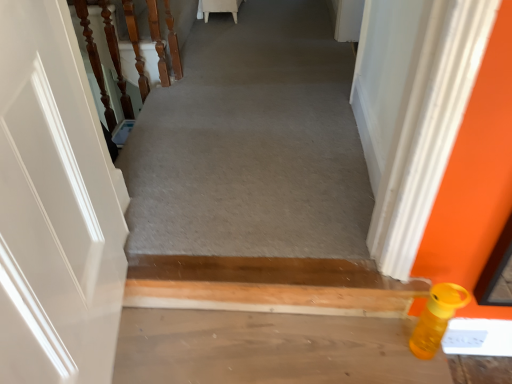
Question: Is wooden balusters at left oriented away from matte plastic bottle at lower right?

Choices:
 (A) no
 (B) yes

Answer: (A)

Question: From a real-world perspective, is wooden balusters at left on top of matte plastic bottle at lower right?

Choices:
 (A) no
 (B) yes

Answer: (B)

Question: Considering the relative sizes of wooden balusters at left and matte plastic bottle at lower right in the image provided, is wooden balusters at left smaller than matte plastic bottle at lower right?

Choices:
 (A) no
 (B) yes

Answer: (B)

Question: Is wooden balusters at left taller than matte plastic bottle at lower right?

Choices:
 (A) yes
 (B) no

Answer: (A)

Question: From the image's perspective, would you say wooden balusters at left is shown under matte plastic bottle at lower right?

Choices:
 (A) no
 (B) yes

Answer: (A)

Question: Considering the relative sizes of wooden balusters at left and matte plastic bottle at lower right in the image provided, is wooden balusters at left bigger than matte plastic bottle at lower right?

Choices:
 (A) no
 (B) yes

Answer: (A)

Question: Does matte plastic bottle at lower right have a larger size compared to yellow matte bottle at lower right?

Choices:
 (A) yes
 (B) no

Answer: (A)

Question: From a real-world perspective, is matte plastic bottle at lower right located higher than yellow matte bottle at lower right?

Choices:
 (A) no
 (B) yes

Answer: (B)

Question: Can you confirm if matte plastic bottle at lower right is wider than yellow matte bottle at lower right?

Choices:
 (A) no
 (B) yes

Answer: (B)

Question: From the image's perspective, is matte plastic bottle at lower right below yellow matte bottle at lower right?

Choices:
 (A) no
 (B) yes

Answer: (A)

Question: Is yellow matte bottle at lower right completely or partially inside matte plastic bottle at lower right?

Choices:
 (A) yes
 (B) no

Answer: (B)

Question: Is matte plastic bottle at lower right positioned before yellow matte bottle at lower right?

Choices:
 (A) yes
 (B) no

Answer: (B)

Question: Can you confirm if wooden balusters at left is smaller than smooth concrete floor at lower right?

Choices:
 (A) no
 (B) yes

Answer: (A)